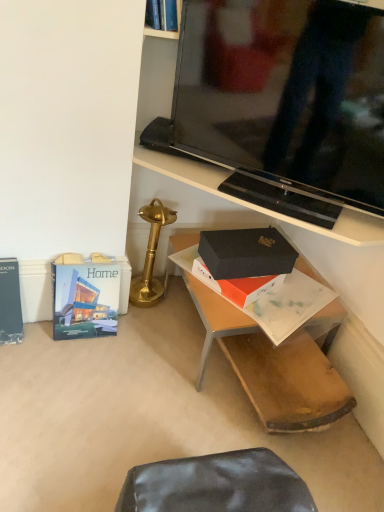
The image size is (384, 512). In order to click on free location in front of black matte box at center in this screenshot , I will do `click(190, 436)`.